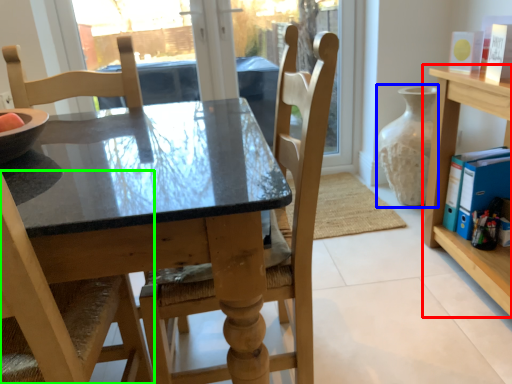
Question: Which object is positioned farthest from shelf (highlighted by a red box)? Select from glass vase (highlighted by a blue box) and chair (highlighted by a green box).

Choices:
 (A) glass vase
 (B) chair

Answer: (B)